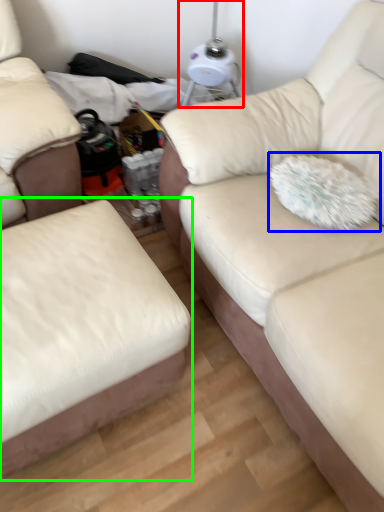
Question: Which object is positioned farthest from table lamp (highlighted by a red box)? Select from throw pillow (highlighted by a blue box) and studio couch (highlighted by a green box).

Choices:
 (A) throw pillow
 (B) studio couch

Answer: (B)